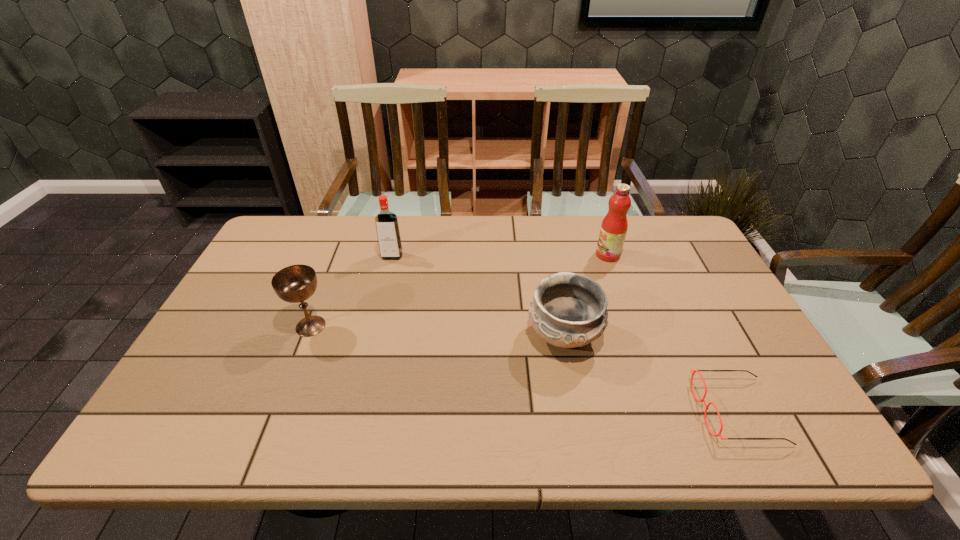
This screenshot has height=540, width=960. What are the coordinates of `empty space that is in between the second shortest object and the second object from left to right` in the screenshot? It's located at (478, 296).

Find the location of a particular element. free space between the fourth object from right to left and the second shortest object is located at coordinates (478, 296).

Find the location of a particular element. unoccupied area between the chalice and the spectacles is located at coordinates (524, 369).

You are a GUI agent. You are given a task and a screenshot of the screen. Output one action in this format:
    pyautogui.click(x=<x>, y=<y>)
    Task: Click on the empty space that is in between the fourth object from left to right and the fourth object from right to left
    The height and width of the screenshot is (540, 960).
    Given the screenshot: What is the action you would take?
    pyautogui.click(x=500, y=255)

The width and height of the screenshot is (960, 540). Identify the location of blank region between the leftmost object and the second object from right to left. (459, 291).

You are a GUI agent. You are given a task and a screenshot of the screen. Output one action in this format:
    pyautogui.click(x=<x>, y=<y>)
    Task: Click on the closest object to the third object from left to right
    This screenshot has width=960, height=540.
    Given the screenshot: What is the action you would take?
    coord(702,400)

Find the location of a particular element. The image size is (960, 540). object that ranks as the fourth closest to the rightmost object is located at coordinates (296, 283).

Where is `vacant space that satisfies the following two spatial constraints: 1. on the front and back of the vodka; 2. on the right side of the second shortest object`? The width and height of the screenshot is (960, 540). vacant space that satisfies the following two spatial constraints: 1. on the front and back of the vodka; 2. on the right side of the second shortest object is located at coordinates (372, 336).

The height and width of the screenshot is (540, 960). Find the location of `free point that satisfies the following two spatial constraints: 1. on the front and back of the second object from left to right; 2. on the right side of the pottery`. free point that satisfies the following two spatial constraints: 1. on the front and back of the second object from left to right; 2. on the right side of the pottery is located at coordinates (372, 336).